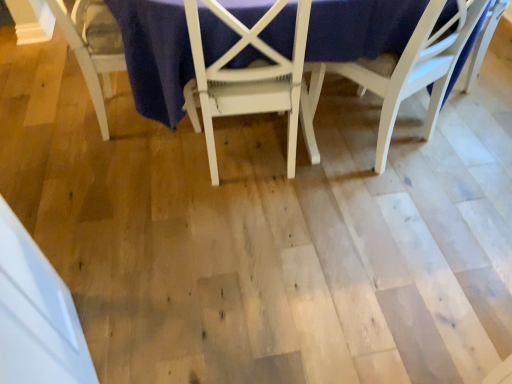
Question: Is white wood chair at lower left, which is the 3th chair in right-to-left order, smaller than white wood chair at upper right, the 3th chair positioned from the left?

Choices:
 (A) yes
 (B) no

Answer: (B)

Question: From the image's perspective, is white wood chair at lower left, which is counted as the first chair, starting from the left, above white wood chair at upper right, the 3th chair positioned from the left?

Choices:
 (A) no
 (B) yes

Answer: (B)

Question: Is the depth of white wood chair at lower left, which is counted as the first chair, starting from the left, less than that of white wood chair at upper right, which is the first chair in right-to-left order?

Choices:
 (A) no
 (B) yes

Answer: (A)

Question: Is white wood chair at lower left, which is counted as the first chair, starting from the left, to the left of white wood chair at upper right, which is the first chair in right-to-left order, from the viewer's perspective?

Choices:
 (A) no
 (B) yes

Answer: (B)

Question: Is white wood chair at lower left, which is the 3th chair in right-to-left order, outside of white wood chair at upper right, the 3th chair positioned from the left?

Choices:
 (A) no
 (B) yes

Answer: (B)

Question: In terms of height, does white painted wood table at center look taller or shorter compared to white wood chair at upper right, the 3th chair positioned from the left?

Choices:
 (A) short
 (B) tall

Answer: (B)

Question: Is white painted wood table at center in front of or behind white wood chair at upper right, which is the first chair in right-to-left order, in the image?

Choices:
 (A) front
 (B) behind

Answer: (A)

Question: Looking at the image, does white painted wood table at center seem bigger or smaller compared to white wood chair at upper right, the 3th chair positioned from the left?

Choices:
 (A) small
 (B) big

Answer: (B)

Question: From a real-world perspective, is white painted wood table at center above or below white wood chair at upper right, which is the first chair in right-to-left order?

Choices:
 (A) below
 (B) above

Answer: (B)

Question: From the image's perspective, relative to white painted wood table at center, is white wood chair at lower left, which is the 3th chair in right-to-left order, above or below?

Choices:
 (A) above
 (B) below

Answer: (B)

Question: Is white wood chair at lower left, which is counted as the first chair, starting from the left, to the left or to the right of white painted wood table at center in the image?

Choices:
 (A) right
 (B) left

Answer: (B)

Question: Based on their sizes in the image, would you say white wood chair at lower left, which is the 3th chair in right-to-left order, is bigger or smaller than white painted wood table at center?

Choices:
 (A) big
 (B) small

Answer: (B)

Question: From a real-world perspective, relative to white painted wood table at center, is white wood chair at lower left, which is the 3th chair in right-to-left order, vertically above or below?

Choices:
 (A) above
 (B) below

Answer: (B)

Question: Considering the positions of point (83, 59) and point (282, 87), is point (83, 59) closer or farther from the camera than point (282, 87)?

Choices:
 (A) farther
 (B) closer

Answer: (A)

Question: In terms of width, does white wood chair at lower left, which is the 3th chair in right-to-left order, look wider or thinner when compared to white painted wood chair at center, the 2th chair when ordered from left to right?

Choices:
 (A) thin
 (B) wide

Answer: (B)